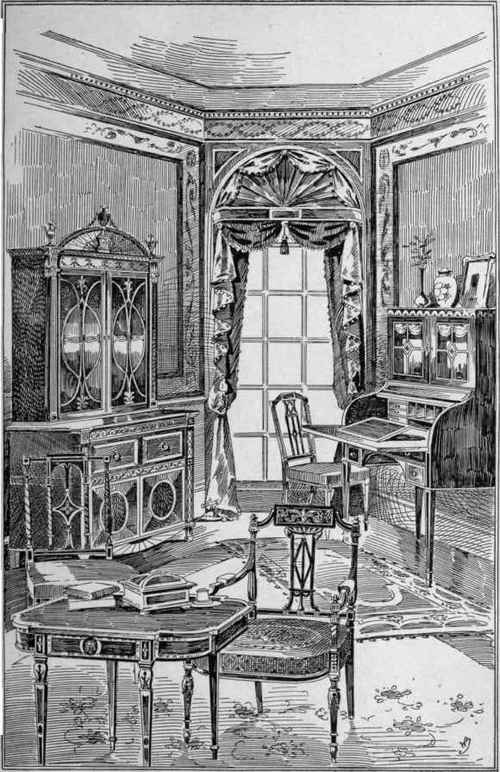
Where is `table`? table is located at coordinates (182, 627).